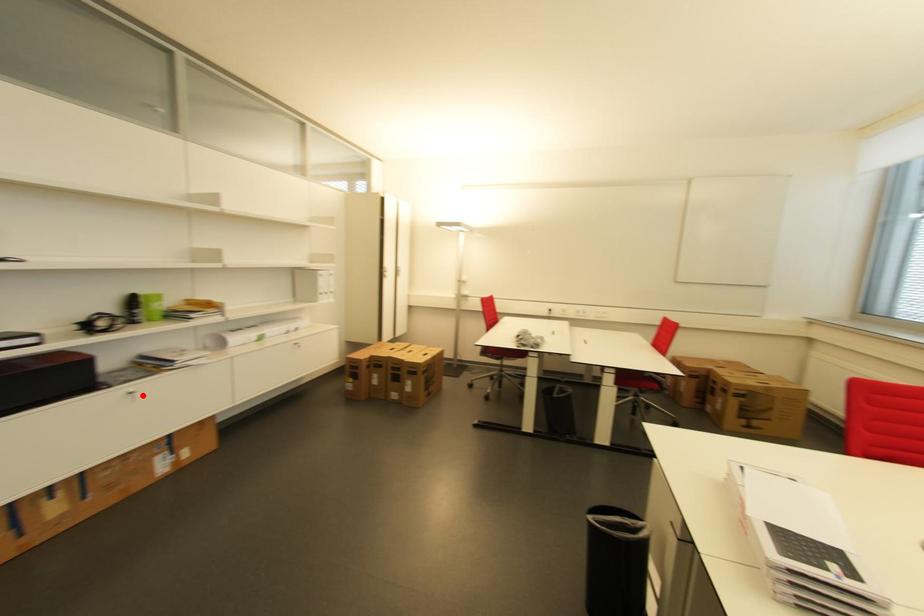
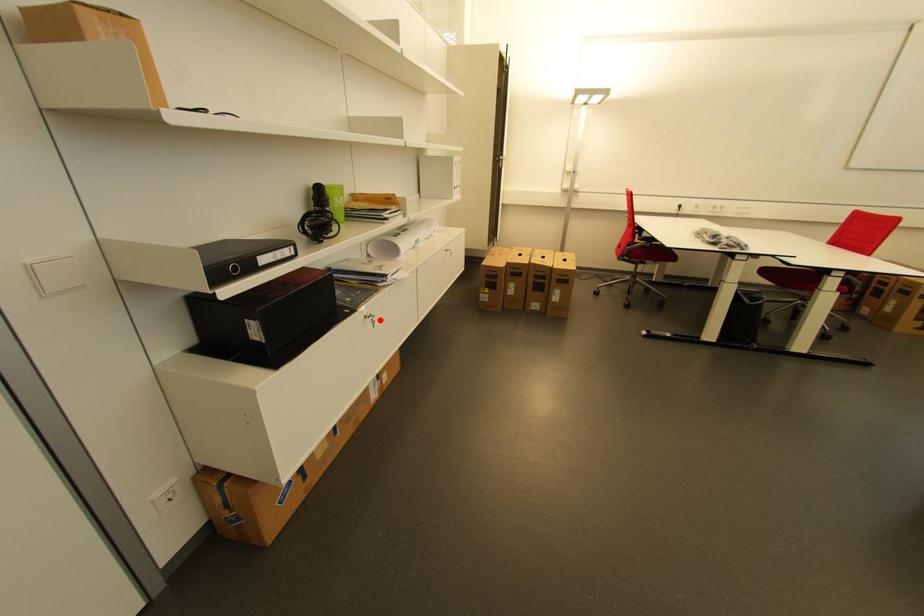
Looking at this image, I am providing you with two images of the same scene from different viewpoints. A red point is marked on the first image and another point is marked on the second image. Is the marked point in image1 the same physical position as the marked point in image2?

Yes